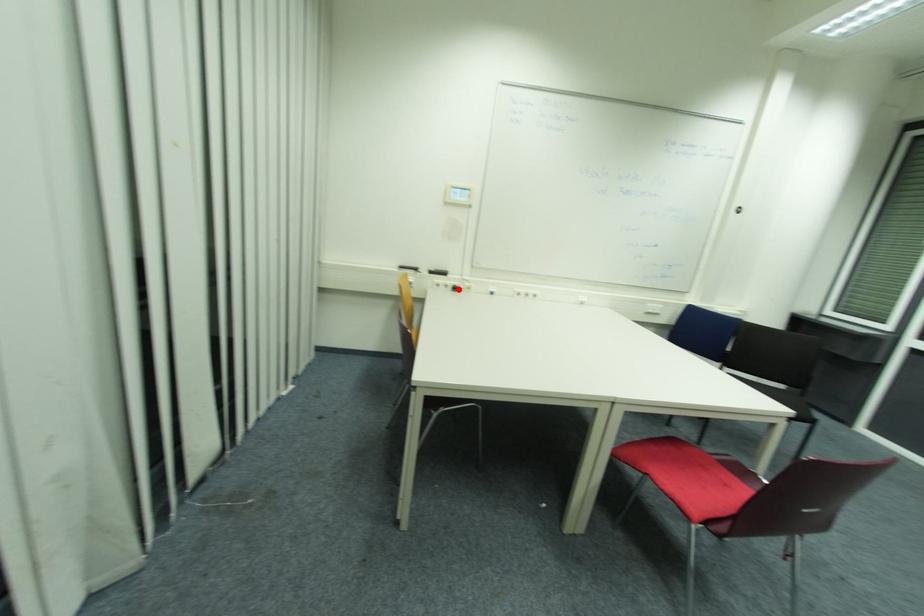
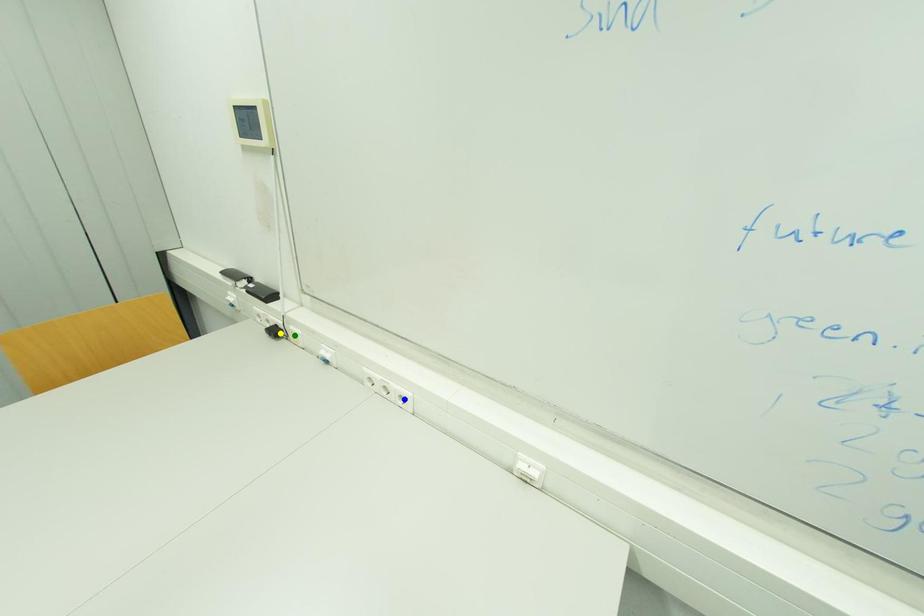
Question: I am providing you with two images of the same scene from different viewpoints. A red point is marked on the first image. You are given multiple points on the second image. Which spot in image 2 lines up with the point in image 1?

Choices:
 (A) blue point
 (B) yellow point
 (C) green point

Answer: (B)